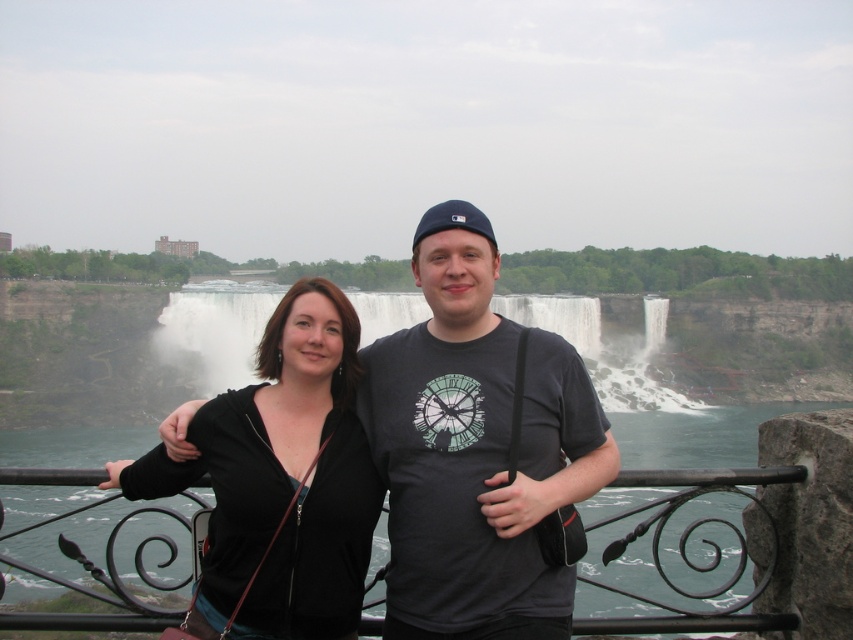
Question: Estimate the real-world distances between objects in this image. Which object is farther from the dark gray t-shirt at center?

Choices:
 (A) black matte jacket at center
 (B) black wrought iron railing at center

Answer: (B)

Question: Does black matte jacket at center have a smaller size compared to black wrought iron railing at center?

Choices:
 (A) yes
 (B) no

Answer: (A)

Question: Which of the following is the farthest from the observer?

Choices:
 (A) (624, 481)
 (B) (331, 464)

Answer: (A)

Question: Does dark gray t-shirt at center have a smaller size compared to black wrought iron railing at center?

Choices:
 (A) yes
 (B) no

Answer: (A)

Question: Which point appears farthest from the camera in this image?

Choices:
 (A) (573, 492)
 (B) (154, 451)
 (C) (753, 595)

Answer: (B)

Question: Can you confirm if black matte jacket at center is positioned below black wrought iron railing at center?

Choices:
 (A) yes
 (B) no

Answer: (B)